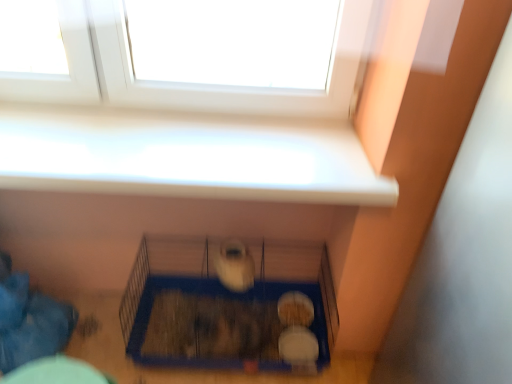
Question: Is white plastic window at upper center wider or thinner than blue wire bird cage at center?

Choices:
 (A) thin
 (B) wide

Answer: (A)

Question: Choose the correct answer: Is white plastic window at upper center inside blue wire bird cage at center or outside it?

Choices:
 (A) outside
 (B) inside

Answer: (A)

Question: From a real-world perspective, is white plastic window at upper center physically located above or below blue wire bird cage at center?

Choices:
 (A) above
 (B) below

Answer: (A)

Question: Is blue wire bird cage at center inside or outside of white plastic window at upper center?

Choices:
 (A) outside
 (B) inside

Answer: (A)

Question: From a real-world perspective, is blue wire bird cage at center positioned above or below white plastic window at upper center?

Choices:
 (A) above
 (B) below

Answer: (B)

Question: Considering the relative positions of blue wire bird cage at center and white plastic window at upper center in the image provided, is blue wire bird cage at center to the left or to the right of white plastic window at upper center?

Choices:
 (A) left
 (B) right

Answer: (B)

Question: In the image, is blue wire bird cage at center positioned in front of or behind white plastic window at upper center?

Choices:
 (A) front
 (B) behind

Answer: (B)